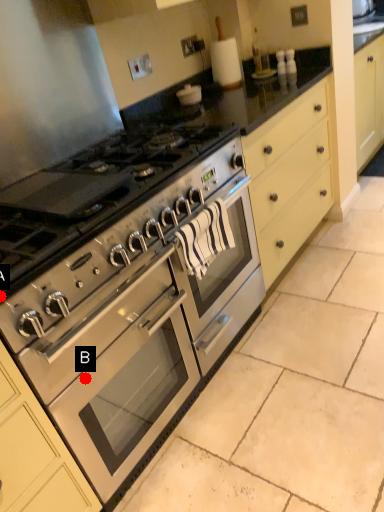
Question: Two points are circled on the image, labeled by A and B beside each circle. Which point appears farthest from the camera in this image?

Choices:
 (A) A is further
 (B) B is further

Answer: (B)